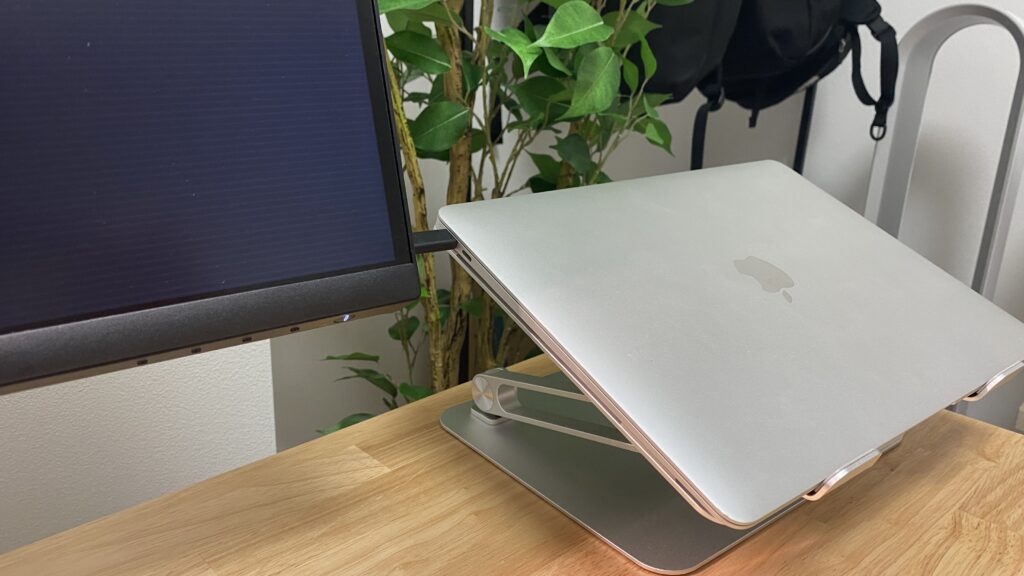
Where is `side of table`? The image size is (1024, 576). side of table is located at coordinates (224, 472), (989, 423).